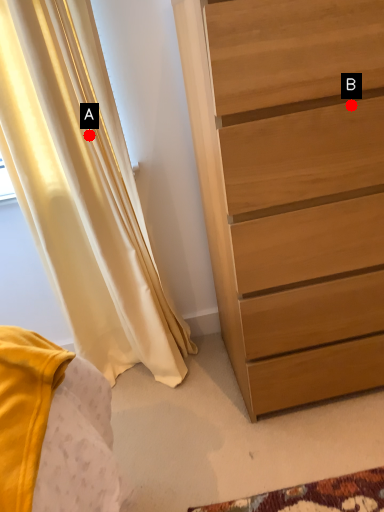
Question: Two points are circled on the image, labeled by A and B beside each circle. Among these points, which one is nearest to the camera?

Choices:
 (A) A is closer
 (B) B is closer

Answer: (B)